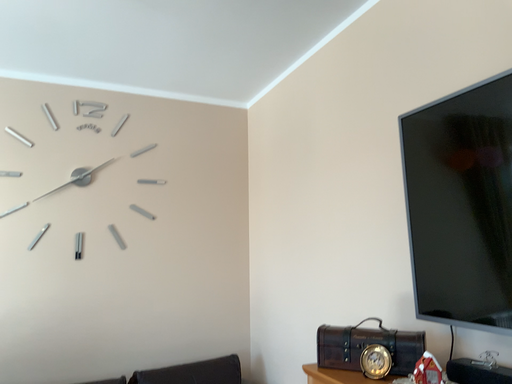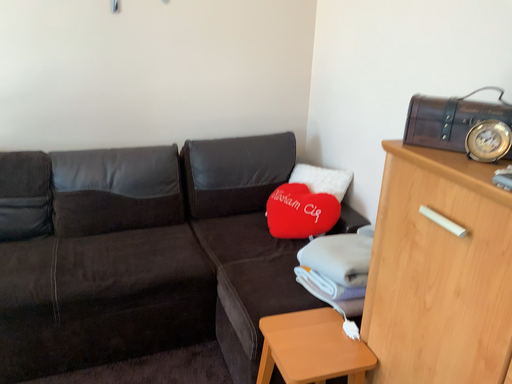
Question: Which way did the camera rotate in the video?

Choices:
 (A) rotated left
 (B) rotated right

Answer: (A)